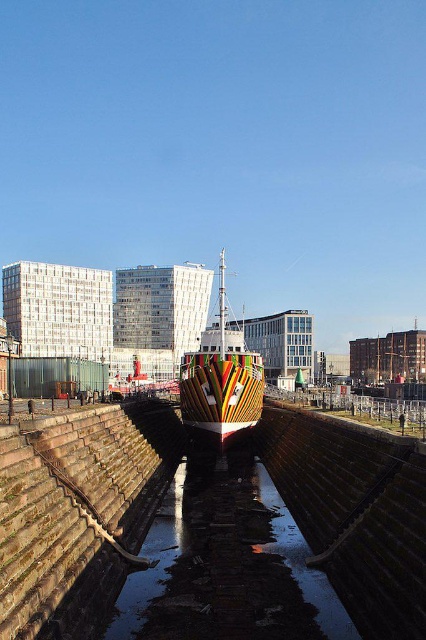
You are standing at the edge of the brick walls in the shipyard scene. You want to place a small floating sensor exactly at the center of the dark reflective water at center. What coordinates should you aim for?

The coordinates for the dark reflective water at center are at point (x=226, y=566), so you should aim for those coordinates to place the sensor exactly at the center.

You are standing at the edge of the waterway and want to know if the dark reflective water at center can fully reflect the multicolored painted ship at center. Based on their heights, can it?

The dark reflective water at center is not as tall as the multicolored painted ship at center, so it cannot fully reflect the ship since the water is shorter in height compared to the ship.